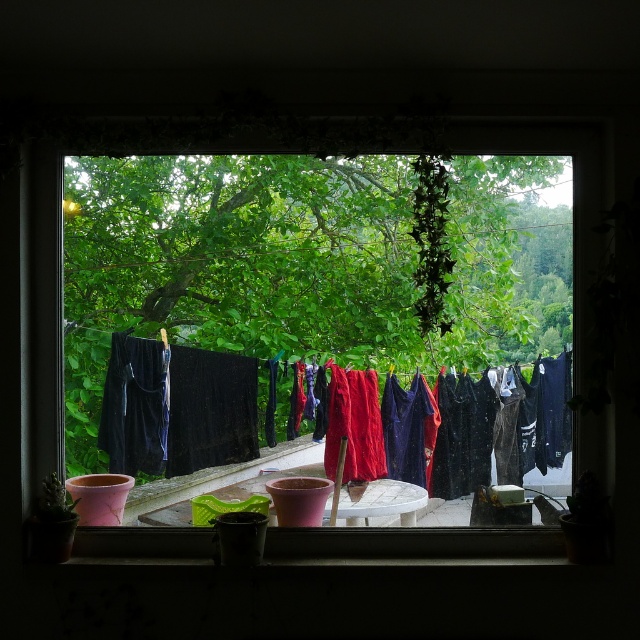
Which is below, transparent glass window at center or red fabric laundry at center?

Positioned lower is red fabric laundry at center.

Can you confirm if transparent glass window at center is wider than red fabric laundry at center?

Yes.

Which is in front, point (296, 342) or point (182, 456)?

Point (182, 456) is more forward.

Locate an element on the screen. The width and height of the screenshot is (640, 640). transparent glass window at center is located at coordinates (298, 275).